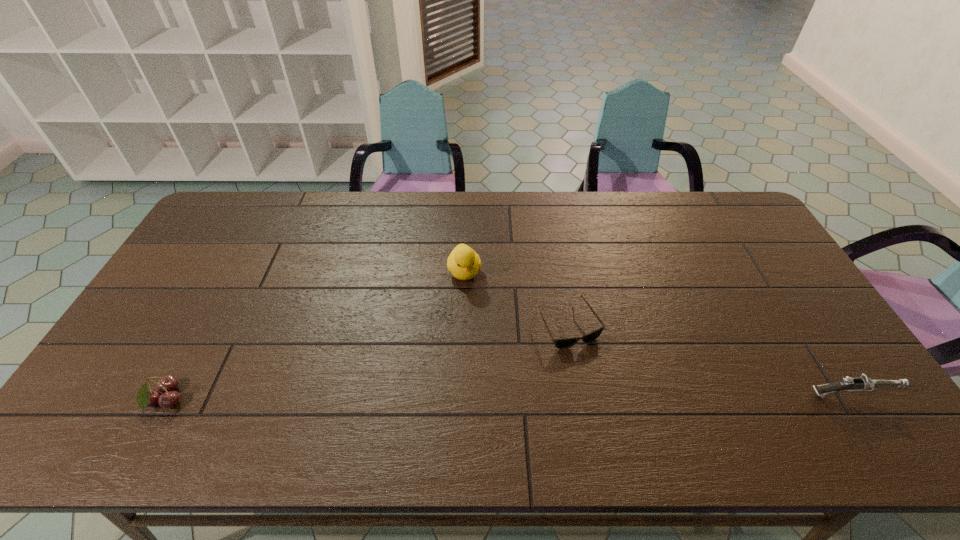
In the image, there is a desktop. At what (x,y) coordinates should I click in order to perform the action: click on free space at the near edge. Please return your answer as a coordinate pair (x, y). The height and width of the screenshot is (540, 960). Looking at the image, I should click on (287, 378).

This screenshot has width=960, height=540. Identify the location of vacant space at the right edge of the desktop. (756, 243).

Where is `vacant area at the far left corner`? Image resolution: width=960 pixels, height=540 pixels. vacant area at the far left corner is located at coordinates (247, 202).

At what (x,y) coordinates should I click in order to perform the action: click on vacant area between the second farthest object and the gun. Please return your answer as a coordinate pair (x, y). The width and height of the screenshot is (960, 540). Looking at the image, I should click on (708, 359).

Locate an element on the screen. free space between the cherry and the second object from right to left is located at coordinates (367, 362).

Identify the location of free space between the cherry and the second object from right to left. (367, 362).

Find the location of a particular element. vacant space that is in between the rightmost object and the shortest object is located at coordinates (708, 359).

This screenshot has height=540, width=960. I want to click on vacant area between the third object from left to right and the leftmost object, so click(x=367, y=362).

Find the location of a particular element. unoccupied position between the tallest object and the third nearest object is located at coordinates (516, 298).

This screenshot has width=960, height=540. Find the location of `vacant point located between the third object from right to left and the shortest object`. vacant point located between the third object from right to left and the shortest object is located at coordinates (516, 298).